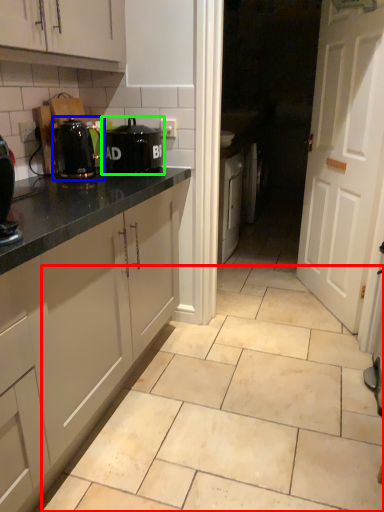
Question: Based on their relative distances, which object is farther from ceramic tile (highlighted by a red box)? Choose from kitchen appliance (highlighted by a blue box) and home appliance (highlighted by a green box).

Choices:
 (A) kitchen appliance
 (B) home appliance

Answer: (A)